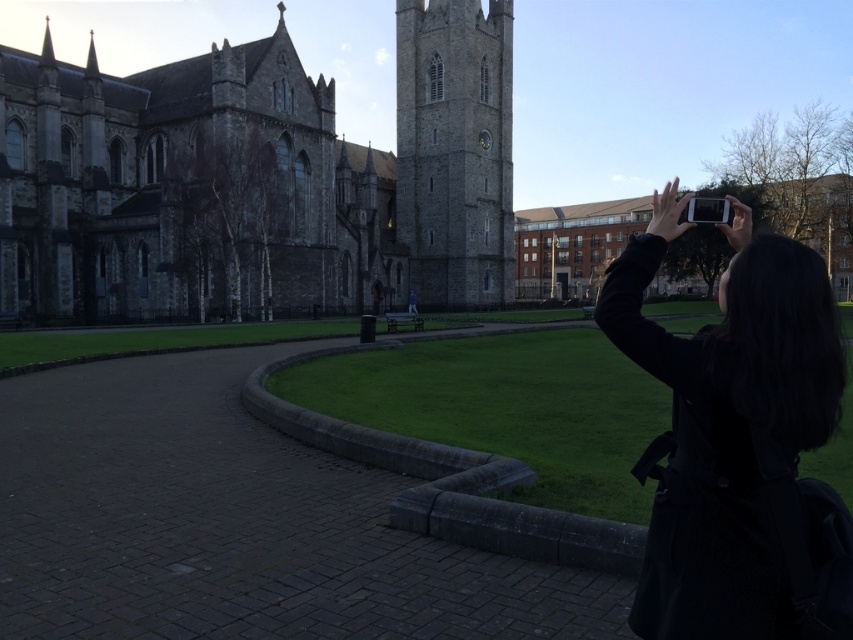
You are standing at the center of the paved pathway in the park adjacent to the gray stone church at left. If you walk straight ahead, will you eventually reach the church?

The gray stone church at left is positioned at point [258,179], which is to the left side of the scene. Since you are on the pathway in the park adjacent to the church and walking straight ahead, you would move away from the church rather than toward it. Therefore, walking straight ahead would not lead you to the church.

You are a photographer planning to take a photo of the gray stone tower at center. You notice the black fabric coat at upper right might block the view. Based on their sizes, can you determine if the coat will be visible in the photo?

The black fabric coat at upper right has a lesser height compared to the gray stone tower at center, so the coat will be visible in the photo as it is shorter than the tower and likely positioned in the foreground.

You are standing on the paved pathway in front of the historic stone church. There are two points marked on the path. One is at coordinate point(262,257) and the other is at point(397,122). Which of these two points is closer to you?

Point(262,257) is closer to the viewer than point(397,122).